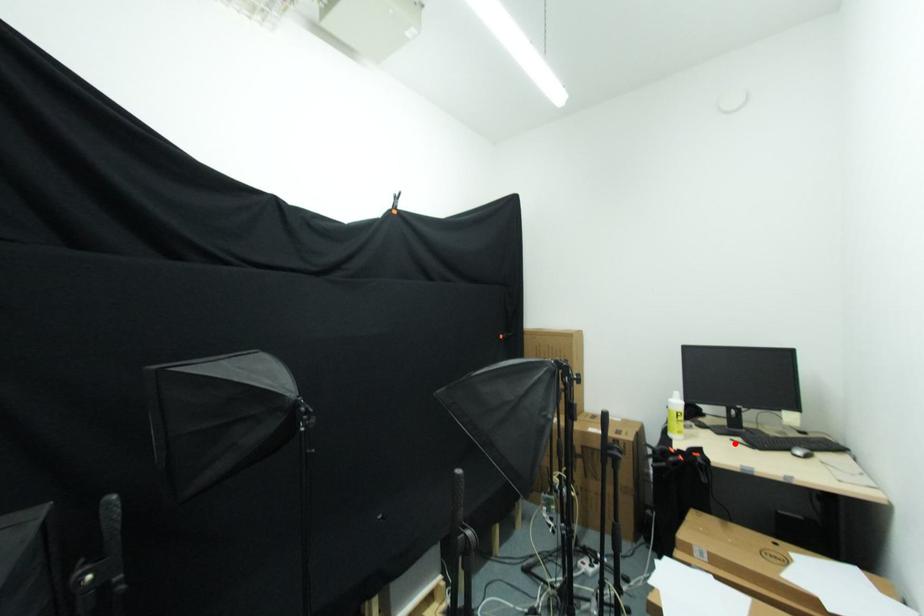
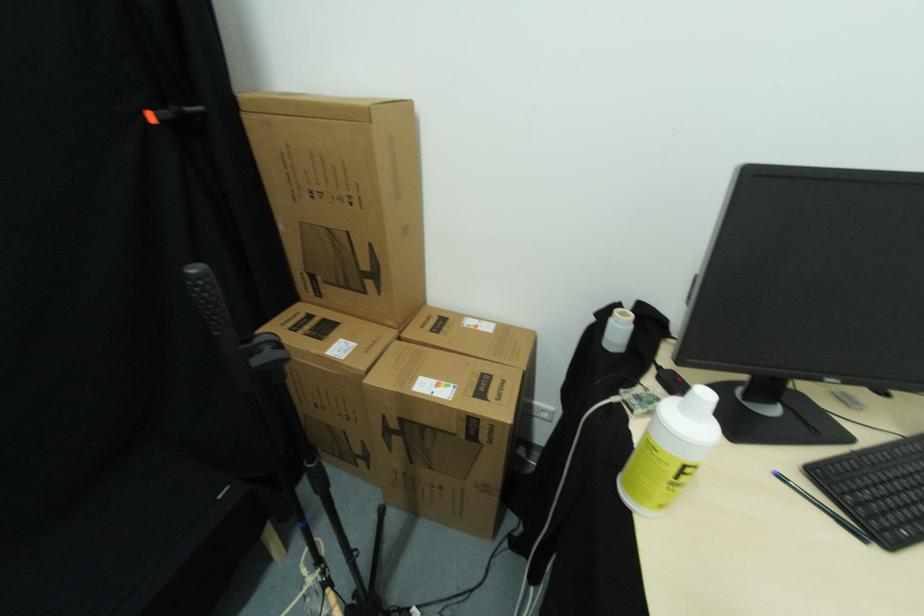
The point at the highlighted location is marked in the first image. Where is the corresponding point in the second image?

(784, 479)